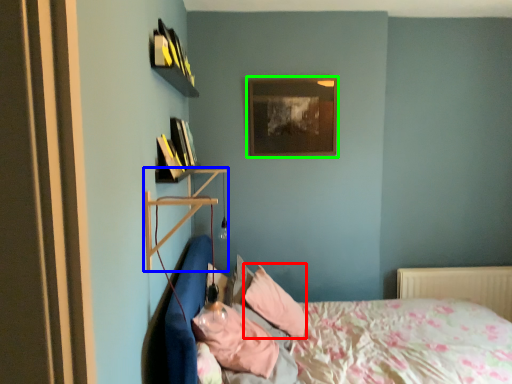
Question: Based on their relative distances, which object is nearer to pillow (highlighted by a red box)? Choose from shelf (highlighted by a blue box) and picture frame (highlighted by a green box).

Choices:
 (A) shelf
 (B) picture frame

Answer: (A)